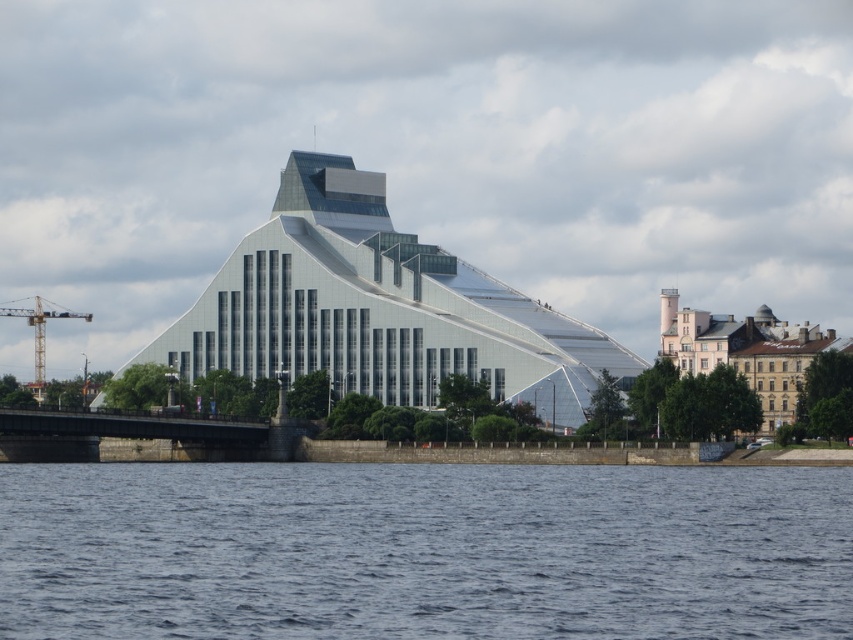
You are standing at the edge of the water in front of the modern building. You notice two points marked on the structure. One is at coordinate point (x=637, y=625) and the other at point (x=718, y=355). If you want to touch the point that is nearer to you, which coordinate should you aim for?

The point at coordinate (x=637, y=625) is closer to the camera, so you should aim for point (x=637, y=625) to touch the one nearer to you.

You are standing on the stone wall in the foreground. You want to walk to the yellow metallic crane at left. Is the blue water at lower center between you and the crane?

The blue water at lower center is closer to the viewer than the yellow metallic crane at left, so yes, the blue water at lower center is between you and the yellow metallic crane at left.